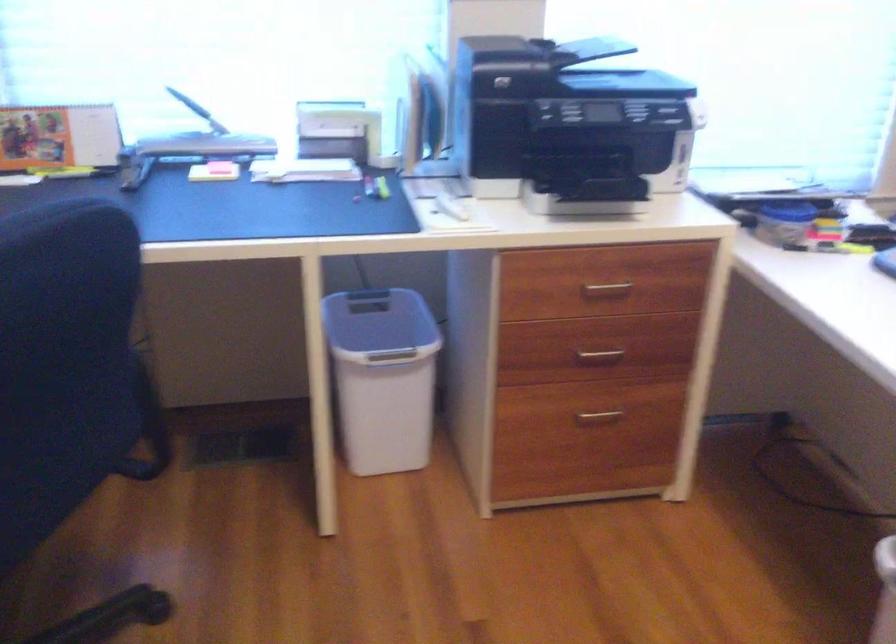
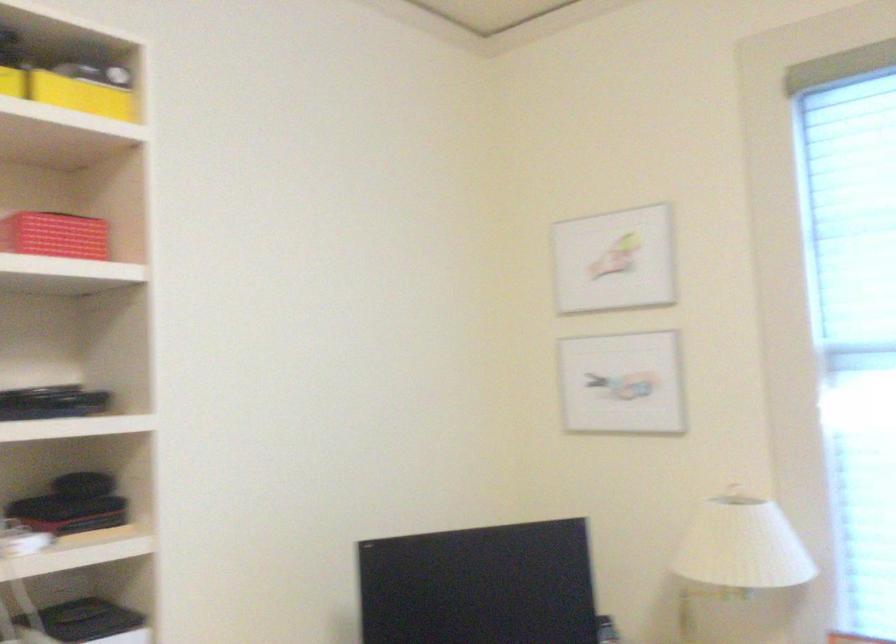
The first image is from the beginning of the video and the second image is from the end. How did the camera likely rotate when shooting the video?

The camera rotated toward left-up.